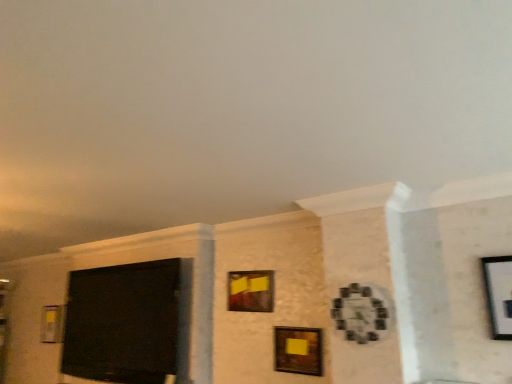
Question: In the image, is matte yellow paper at center, the 2th picture frame positioned from the left, on the left side or the right side of matte wooden picture frame at center, which is the second picture frame in front-to-back order?

Choices:
 (A) right
 (B) left

Answer: (B)

Question: In the image, is matte yellow paper at center, which is the third picture frame in right-to-left order, positioned in front of or behind matte wooden picture frame at center, acting as the 3th picture frame starting from the back?

Choices:
 (A) front
 (B) behind

Answer: (B)

Question: Which object is positioned closest to the matte black screen at left?

Choices:
 (A) matte black picture frame at left, positioned as the first picture frame in left-to-right order
 (B) matte yellow paper at center, which ranks as the third picture frame in front-to-back order
 (C) matte wooden picture frame at center, which appears as the third picture frame when viewed from the left
 (D) wooden clock at center-right, arranged as the 4th picture frame when viewed from the back

Answer: (B)

Question: Based on their relative distances, which object is nearer to the matte black screen at left?

Choices:
 (A) matte yellow paper at center, which is the third picture frame in right-to-left order
 (B) matte black picture frame at left, positioned as the first picture frame in left-to-right order
 (C) wooden clock at center-right, which appears as the first picture frame when viewed from the front
 (D) matte wooden picture frame at center, which is the second picture frame in front-to-back order

Answer: (A)